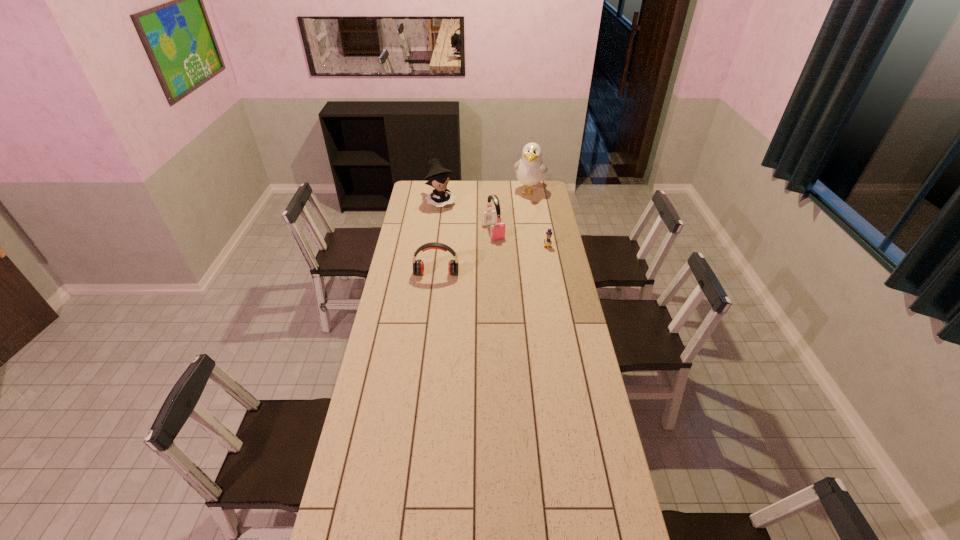
The height and width of the screenshot is (540, 960). In order to click on doll situated at the far edge in this screenshot , I will do `click(438, 177)`.

Where is `earphone situated at the left edge`? This screenshot has width=960, height=540. earphone situated at the left edge is located at coordinates (418, 266).

You are a GUI agent. You are given a task and a screenshot of the screen. Output one action in this format:
    pyautogui.click(x=<x>, y=<y>)
    Task: Click on the doll that is positioned at the left edge
    The height and width of the screenshot is (540, 960).
    Given the screenshot: What is the action you would take?
    pyautogui.click(x=438, y=177)

Where is `duckling that is at the right edge`? The height and width of the screenshot is (540, 960). duckling that is at the right edge is located at coordinates (548, 242).

Locate an element on the screen. Image resolution: width=960 pixels, height=540 pixels. gull situated at the right edge is located at coordinates (530, 170).

At what (x,y) coordinates should I click in order to perform the action: click on object that is at the far left corner. Please return your answer as a coordinate pair (x, y). Looking at the image, I should click on (438, 177).

I want to click on object that is positioned at the far right corner, so click(530, 170).

Where is `vacant space at the far edge of the desktop`? The width and height of the screenshot is (960, 540). vacant space at the far edge of the desktop is located at coordinates (516, 190).

Identify the location of free region at the left edge. The width and height of the screenshot is (960, 540). (387, 299).

Where is `free point at the right edge`? This screenshot has width=960, height=540. free point at the right edge is located at coordinates (576, 316).